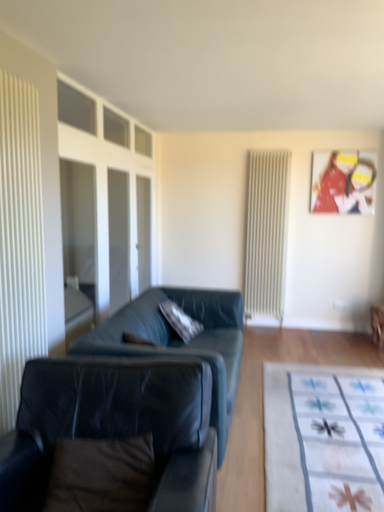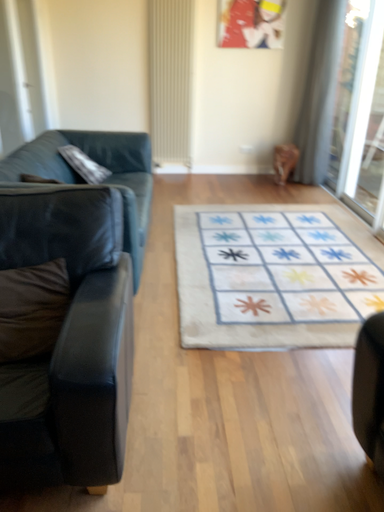
Question: Which way did the camera rotate in the video?

Choices:
 (A) rotated left
 (B) rotated right

Answer: (B)